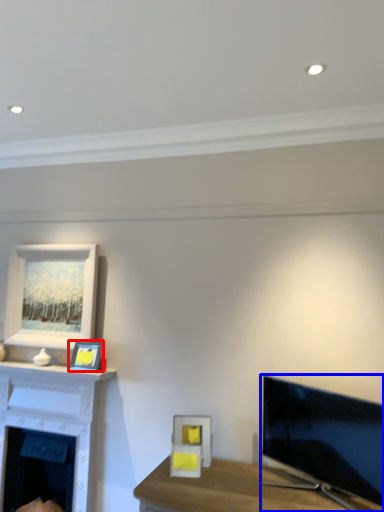
Question: Which object is further to the camera taking this photo, picture frame (highlighted by a red box) or television (highlighted by a blue box)?

Choices:
 (A) picture frame
 (B) television

Answer: (A)